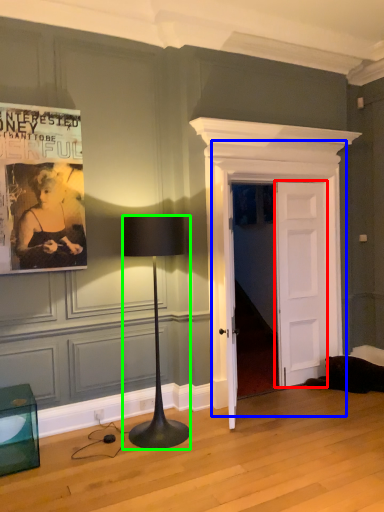
Question: Based on their relative distances, which object is farther from door (highlighted by a red box)? Choose from door (highlighted by a blue box) and lamp (highlighted by a green box).

Choices:
 (A) door
 (B) lamp

Answer: (B)